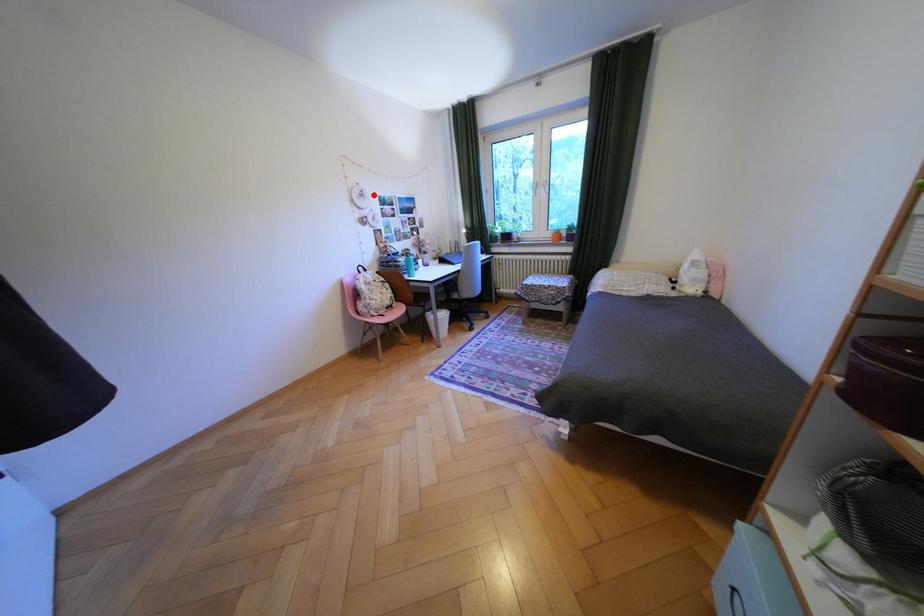
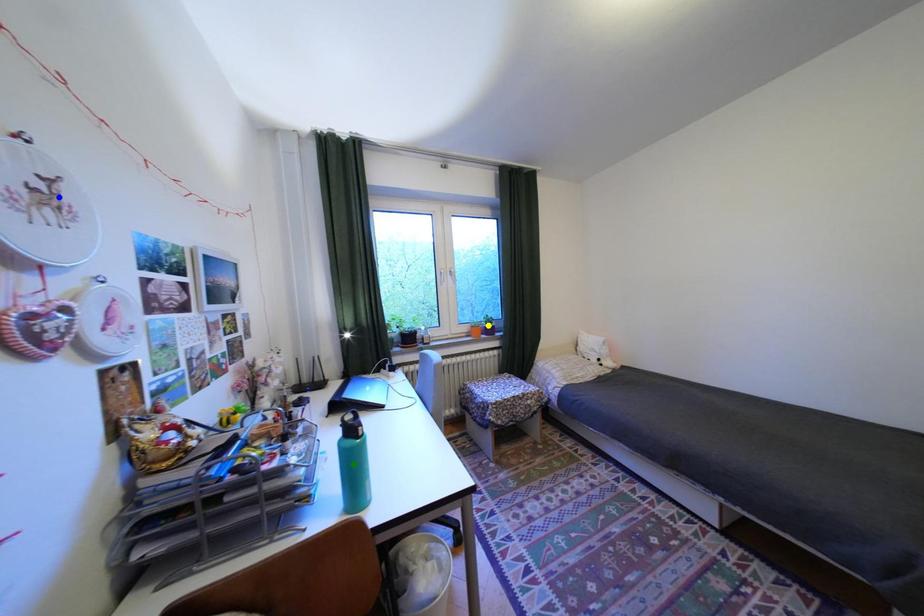
Question: I am providing you with two images of the same scene from different viewpoints. A red point is marked on the first image. You are given multiple points on the second image. Which mark in image 2 goes with the point in image 1?

Choices:
 (A) yellow point
 (B) blue point
 (C) green point

Answer: (B)